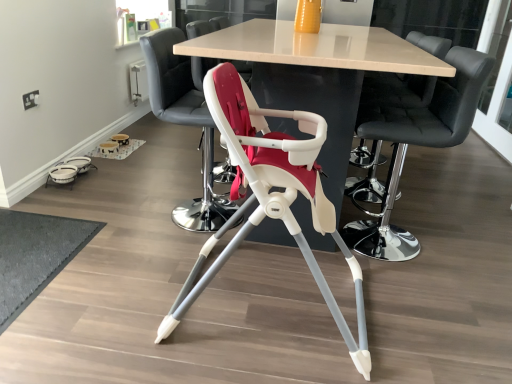
Question: Looking at the image, does smooth black bar stool at center, placed as the first chair when sorted from right to left, seem bigger or smaller compared to matte white table at center?

Choices:
 (A) small
 (B) big

Answer: (A)

Question: Is point (361, 119) closer or farther from the camera than point (326, 51)?

Choices:
 (A) closer
 (B) farther

Answer: (B)

Question: Which of these objects is positioned closest to the black leather bar stool at upper center, the second chair from the right?

Choices:
 (A) dark gray textured mat at lower left
 (B) matte white highchair at center, acting as the 3th chair starting from the right
 (C) white plastic highchair at center, positioned as the first chair in left-to-right order
 (D) smooth black bar stool at center, marked as the 4th chair in a left-to-right arrangement
 (E) transparent glass door at upper right

Answer: (D)

Question: Which object is the closest to the black leather bar stool at upper center, the second chair from the right?

Choices:
 (A) smooth black bar stool at center, placed as the first chair when sorted from right to left
 (B) white plastic highchair at center, positioned as the first chair in left-to-right order
 (C) matte white table at center
 (D) transparent glass door at upper right
 (E) dark gray textured mat at lower left

Answer: (A)